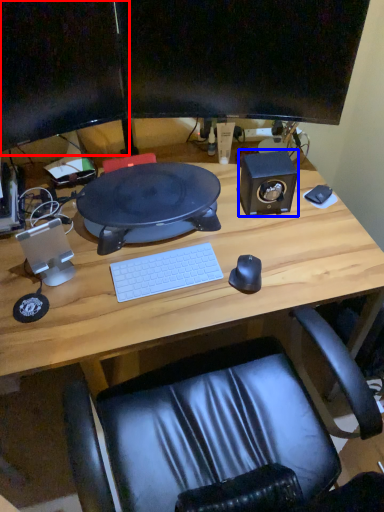
Question: Which of the following is the closest to the observer, computer monitor (highlighted by a red box) or speaker (highlighted by a blue box)?

Choices:
 (A) computer monitor
 (B) speaker

Answer: (A)